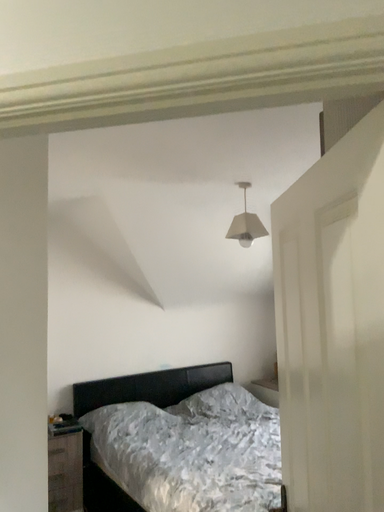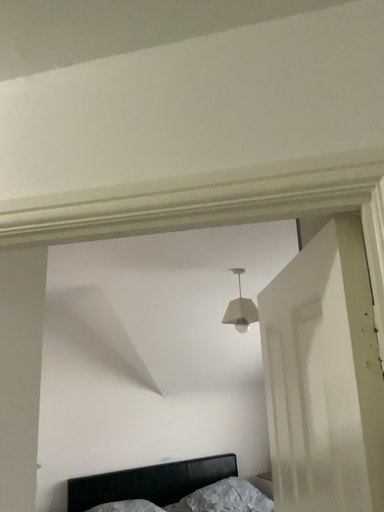
Question: How did the camera likely rotate when shooting the video?

Choices:
 (A) rotated downward
 (B) rotated upward

Answer: (B)